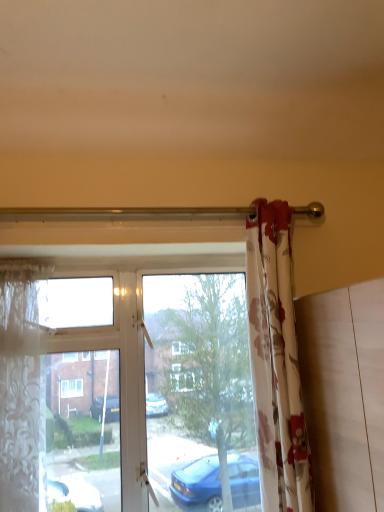
Question: Is translucent floral fabric at left, the first curtain when ordered from left to right, behind floral fabric curtain at right, placed as the first curtain when sorted from right to left?

Choices:
 (A) yes
 (B) no

Answer: (A)

Question: Can you confirm if translucent floral fabric at left, arranged as the 2th curtain when viewed from the right, is bigger than floral fabric curtain at right, placed as the first curtain when sorted from right to left?

Choices:
 (A) yes
 (B) no

Answer: (B)

Question: From the image's perspective, is translucent floral fabric at left, arranged as the 2th curtain when viewed from the right, over floral fabric curtain at right, placed as the first curtain when sorted from right to left?

Choices:
 (A) yes
 (B) no

Answer: (B)

Question: Can you confirm if translucent floral fabric at left, the first curtain when ordered from left to right, is shorter than floral fabric curtain at right, the 2th curtain from the left?

Choices:
 (A) no
 (B) yes

Answer: (B)

Question: Is there a large distance between translucent floral fabric at left, the first curtain when ordered from left to right, and floral fabric curtain at right, the 2th curtain from the left?

Choices:
 (A) no
 (B) yes

Answer: (A)

Question: From a real-world perspective, is floral fabric curtain at right, the 2th curtain from the left, above or below transparent glass window at center?

Choices:
 (A) above
 (B) below

Answer: (A)

Question: From the image's perspective, is floral fabric curtain at right, the 2th curtain from the left, located above or below transparent glass window at center?

Choices:
 (A) above
 (B) below

Answer: (A)

Question: Considering the positions of floral fabric curtain at right, placed as the first curtain when sorted from right to left, and transparent glass window at center in the image, is floral fabric curtain at right, placed as the first curtain when sorted from right to left, wider or thinner than transparent glass window at center?

Choices:
 (A) thin
 (B) wide

Answer: (B)

Question: Is floral fabric curtain at right, placed as the first curtain when sorted from right to left, bigger or smaller than transparent glass window at center?

Choices:
 (A) small
 (B) big

Answer: (A)

Question: Would you say floral fabric curtain at right, the 2th curtain from the left, is inside or outside translucent floral fabric at left, the first curtain when ordered from left to right?

Choices:
 (A) outside
 (B) inside

Answer: (A)

Question: In terms of width, does floral fabric curtain at right, placed as the first curtain when sorted from right to left, look wider or thinner when compared to translucent floral fabric at left, the first curtain when ordered from left to right?

Choices:
 (A) wide
 (B) thin

Answer: (A)

Question: Considering the positions of floral fabric curtain at right, placed as the first curtain when sorted from right to left, and translucent floral fabric at left, arranged as the 2th curtain when viewed from the right, in the image, is floral fabric curtain at right, placed as the first curtain when sorted from right to left, taller or shorter than translucent floral fabric at left, arranged as the 2th curtain when viewed from the right,?

Choices:
 (A) short
 (B) tall

Answer: (B)

Question: From a real-world perspective, relative to translucent floral fabric at left, the first curtain when ordered from left to right, is floral fabric curtain at right, the 2th curtain from the left, vertically above or below?

Choices:
 (A) below
 (B) above

Answer: (B)

Question: In terms of width, does translucent floral fabric at left, arranged as the 2th curtain when viewed from the right, look wider or thinner when compared to floral fabric curtain at right, placed as the first curtain when sorted from right to left?

Choices:
 (A) wide
 (B) thin

Answer: (B)

Question: Is translucent floral fabric at left, arranged as the 2th curtain when viewed from the right, in front of or behind floral fabric curtain at right, the 2th curtain from the left, in the image?

Choices:
 (A) behind
 (B) front

Answer: (A)